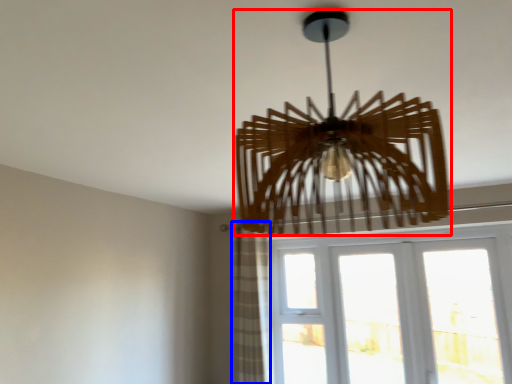
Question: Which point is further to the camera, lamp (highlighted by a red box) or curtain (highlighted by a blue box)?

Choices:
 (A) lamp
 (B) curtain

Answer: (B)